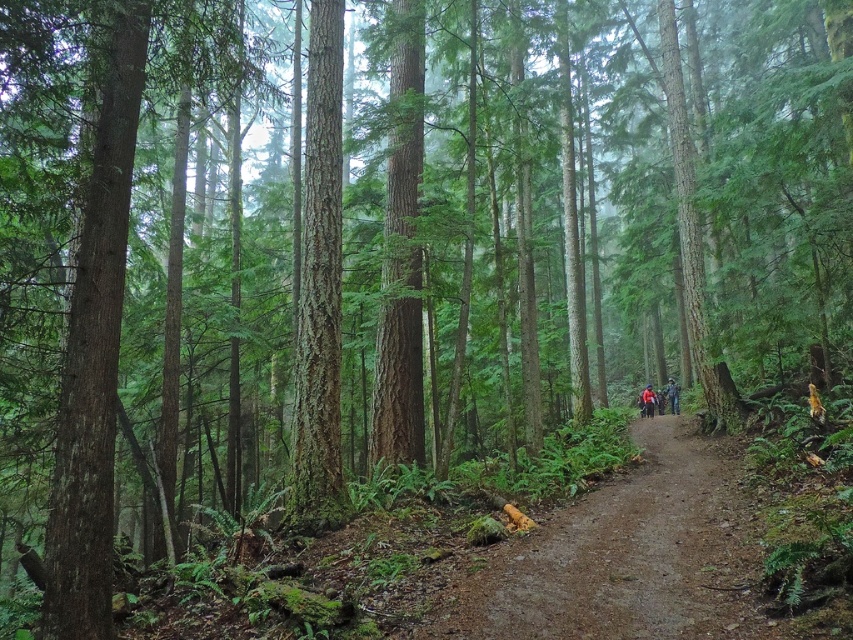
Question: Does dirt path at center appear on the left side of green camouflage jacket at center-right?

Choices:
 (A) yes
 (B) no

Answer: (A)

Question: Which point is closer to the camera?

Choices:
 (A) red fabric jacket at center-right
 (B) dirt path at center

Answer: (B)

Question: Is red fabric jacket at center-right wider than green camouflage jacket at center-right?

Choices:
 (A) no
 (B) yes

Answer: (B)

Question: Does dirt path at center have a larger size compared to red fabric jacket at center-right?

Choices:
 (A) no
 (B) yes

Answer: (B)

Question: Which object appears farthest from the camera in this image?

Choices:
 (A) red fabric jacket at center-right
 (B) dirt path at center
 (C) green camouflage jacket at center-right

Answer: (A)

Question: Among these objects, which one is farthest from the camera?

Choices:
 (A) green camouflage jacket at center-right
 (B) red fabric jacket at center-right
 (C) dirt path at center

Answer: (B)